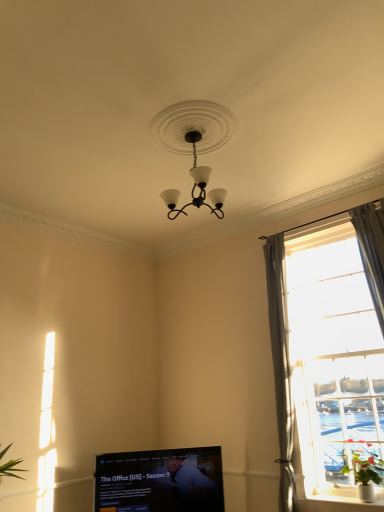
What do you see at coordinates (196, 186) in the screenshot? I see `matte black chandelier at center` at bounding box center [196, 186].

In order to face white glossy window sill at lower right, should I rotate leftwards or rightwards?

To face it directly, rotate right by 19.553 degrees.

What are the coordinates of `green leafy plant at right` in the screenshot? It's located at (364, 464).

This screenshot has height=512, width=384. Describe the element at coordinates (364, 464) in the screenshot. I see `green leafy plant at right` at that location.

At what (x,y) coordinates should I click in order to perform the action: click on matte black chandelier at center. Please return your answer as a coordinate pair (x, y). The height and width of the screenshot is (512, 384). Looking at the image, I should click on (196, 186).

Is green leafy plant at right positioned with its back to clear glass window at right?

Yes, green leafy plant at right's orientation is away from clear glass window at right.

Consider the image. From a real-world perspective, relative to clear glass window at right, is green leafy plant at right vertically above or below?

→ From a real-world perspective, green leafy plant at right is physically below clear glass window at right.

Can you confirm if green leafy plant at right is thinner than clear glass window at right?

Incorrect, the width of green leafy plant at right is not less than that of clear glass window at right.

Considering the sizes of clear glass window at right and green leafy plant at right in the image, is clear glass window at right wider or thinner than green leafy plant at right?

Clearly, clear glass window at right has less width compared to green leafy plant at right.

At what (x,y) coordinates should I click in order to perform the action: click on plant below the clear glass window at right (from the image's perspective). Please return your answer as a coordinate pair (x, y). This screenshot has height=512, width=384. Looking at the image, I should click on (364, 464).

How different are the orientations of clear glass window at right and green leafy plant at right in degrees?

The angle between the facing direction of clear glass window at right and the facing direction of green leafy plant at right is 7.72e-05 degrees.

Is clear glass window at right inside or outside of green leafy plant at right?

clear glass window at right is not inside green leafy plant at right, it's outside.

Between matte black television at lower center and white glossy window sill at lower right, which one has larger size?

matte black television at lower center.

Which object is thinner, matte black television at lower center or white glossy window sill at lower right?

Thinner between the two is white glossy window sill at lower right.

Which of these two, matte black television at lower center or white glossy window sill at lower right, stands taller?

matte black television at lower center is taller.

This screenshot has width=384, height=512. What are the coordinates of `television that appears below the matte black chandelier at center (from a real-world perspective)` in the screenshot? It's located at (160, 481).

Relative to matte black television at lower center, is matte black chandelier at center in front or behind?

matte black chandelier at center is in front of matte black television at lower center.

Which object is thinner, matte black chandelier at center or matte black television at lower center?

matte black television at lower center.

Is matte black chandelier at center not near matte black television at lower center?

Yes, matte black chandelier at center and matte black television at lower center are quite far apart.

From the image's perspective, who appears lower, green leafy plant at right or white glossy window sill at lower right?

white glossy window sill at lower right, from the image's perspective.

Is green leafy plant at right taller or shorter than white glossy window sill at lower right?

Clearly, green leafy plant at right is taller compared to white glossy window sill at lower right.

Does white glossy window sill at lower right have a smaller size compared to matte black television at lower center?

Correct, white glossy window sill at lower right occupies less space than matte black television at lower center.

Which object is closer to the camera taking this photo, white glossy window sill at lower right or matte black television at lower center?

white glossy window sill at lower right is more forward.

From the image's perspective, which one is positioned higher, white glossy window sill at lower right or matte black television at lower center?

white glossy window sill at lower right.

From a real-world perspective, which is physically above, matte black chandelier at center or green leafy plant at right?

matte black chandelier at center.

Are matte black chandelier at center and green leafy plant at right beside each other?

No, matte black chandelier at center is not next to green leafy plant at right.

Consider the image. Does matte black chandelier at center appear on the left side of green leafy plant at right?

Yes.

Is matte black chandelier at center inside the boundaries of green leafy plant at right, or outside?

matte black chandelier at center is not enclosed by green leafy plant at right.

Find the location of a particular element. The height and width of the screenshot is (512, 384). window on the right of green leafy plant at right is located at coordinates (329, 343).

The width and height of the screenshot is (384, 512). In order to click on window above the green leafy plant at right (from the image's perspective) in this screenshot , I will do `click(329, 343)`.

Looking at the image, which one is located further to matte black television at lower center, white glossy window sill at lower right or matte black chandelier at center?

The object further to matte black television at lower center is matte black chandelier at center.

When comparing their distances from clear glass window at right, does white glossy window sill at lower right or green leafy plant at right seem further?

Based on the image, white glossy window sill at lower right appears to be further to clear glass window at right.

From the picture: Looking at the image, which one is located further to clear glass window at right, matte black television at lower center or green leafy plant at right?

matte black television at lower center.

Based on their spatial positions, is green leafy plant at right or matte black chandelier at center closer to clear glass window at right?

Based on the image, green leafy plant at right appears to be nearer to clear glass window at right.

Estimate the real-world distances between objects in this image. Which object is closer to matte black television at lower center, clear glass window at right or matte black chandelier at center?

clear glass window at right is positioned closer to the anchor matte black television at lower center.

When comparing their distances from matte black chandelier at center, does green leafy plant at right or matte black television at lower center seem further?

Based on the image, matte black television at lower center appears to be further to matte black chandelier at center.

Based on their spatial positions, is matte black television at lower center or white glossy window sill at lower right closer to green leafy plant at right?

white glossy window sill at lower right.

Considering their positions, is green leafy plant at right positioned further to matte black television at lower center than clear glass window at right?

Based on the image, green leafy plant at right appears to be further to matte black television at lower center.

Where is `plant between matte black chandelier at center and white glossy window sill at lower right vertically`? plant between matte black chandelier at center and white glossy window sill at lower right vertically is located at coordinates (364, 464).

The width and height of the screenshot is (384, 512). What are the coordinates of `plant between clear glass window at right and white glossy window sill at lower right vertically` in the screenshot? It's located at (364, 464).

Identify the location of window that lies between matte black chandelier at center and white glossy window sill at lower right from top to bottom. This screenshot has width=384, height=512. (329, 343).

This screenshot has height=512, width=384. What are the coordinates of `window between matte black chandelier at center and green leafy plant at right from top to bottom` in the screenshot? It's located at (329, 343).